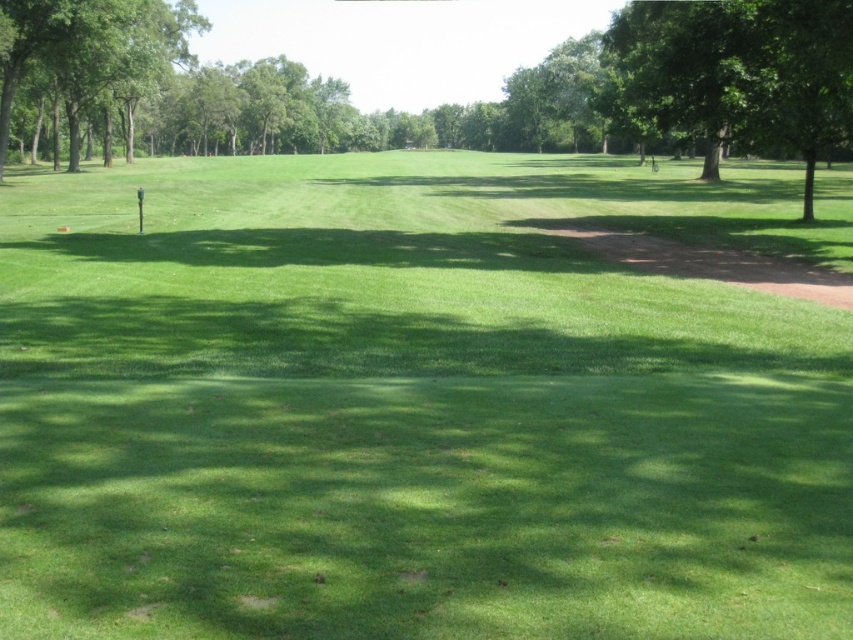
You are a landscape architect designing a new park layout. You need to place a statue exactly halfway between the green leafy tree at upper right and the green leafy tree at upper left. Given their heights, which tree will the statue be closer to?

The statue will be closer to the green leafy tree at upper left because it is shorter than the green leafy tree at upper right, so the midpoint between them would naturally be nearer to the shorter tree.

You are standing at the center of the grassy area and want to walk towards the green leafy tree at upper right. Which direction should you head?

The green leafy tree at upper right is located at coordinates point (x=737, y=72), so you should head towards the upper right direction to reach it.